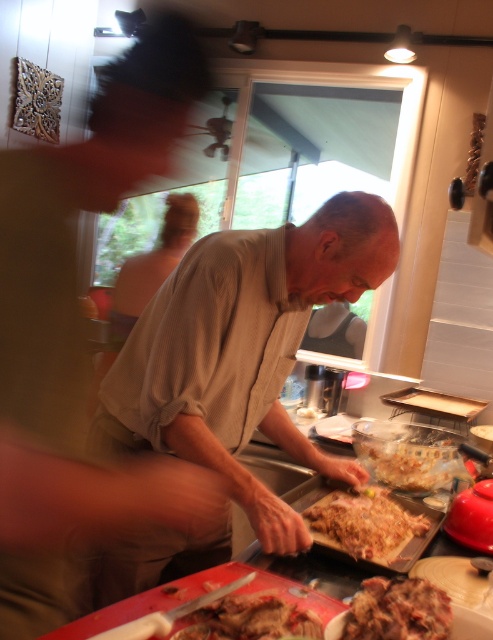
You are standing in the kitchen and want to reach both the point at coordinates (171, 401) and the point at coordinates (248, 630). Which point will you reach first?

You will reach the point at coordinates (171, 401) first because it is closer to you than the point at coordinates (248, 630), which is further away.

Consider the image. You are a chef in the kitchen. You see a point marked at coordinates [365,524]. What is located at that point?

The point at coordinates [365,524] has brown crispy skin at center.